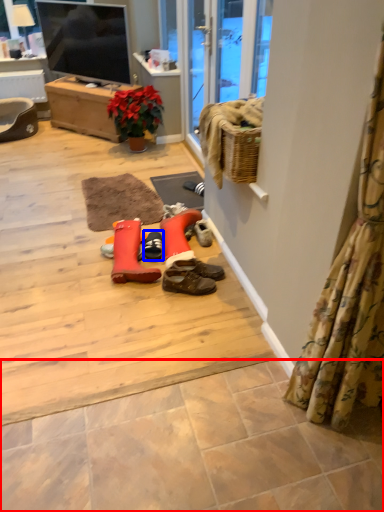
Question: Which of the following is the farthest to the observer, tile (highlighted by a red box) or footwear (highlighted by a blue box)?

Choices:
 (A) tile
 (B) footwear

Answer: (B)